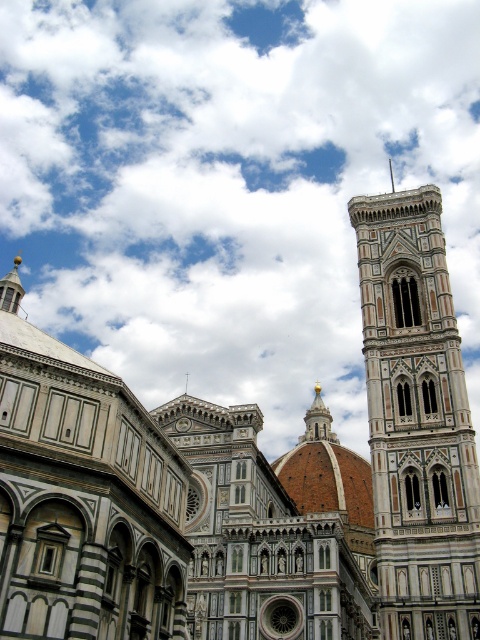
You are standing in front of the Florence Cathedral and its bell tower. You notice two points marked in the scene. One is at coordinate point(240, 205) and the other at point(379, 314). Which point is closer to your eyes?

Point(240, 205) is closer to your eyes because it is further to the camera than point(379, 314).

You are an architect analyzing the Florence Cathedral scene. You observe the white fluffy cloud at upper center and the white marble bell tower at right. Which of these two objects has a greater width in the image?

The white fluffy cloud at upper center has a greater width than the white marble bell tower at right according to the description.

Looking at this image, you are an architect analyzing the spatial relationship between the white fluffy cloud at upper center and the white marble bell tower at right in the image. Which object appears closer to the observer?

The white fluffy cloud at upper center appears closer to the observer because it is further to the viewer than the white marble bell tower at right.